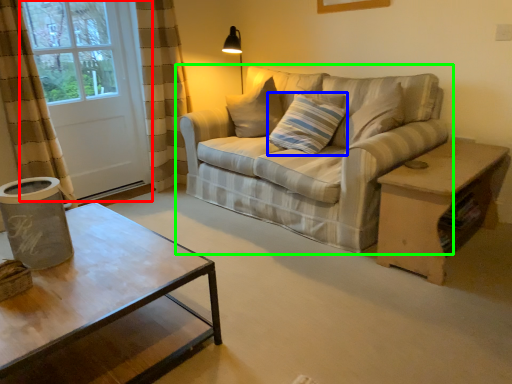
Question: Which is nearer to the screen door (highlighted by a red box)? pillow (highlighted by a blue box) or studio couch (highlighted by a green box).

Choices:
 (A) pillow
 (B) studio couch

Answer: (B)